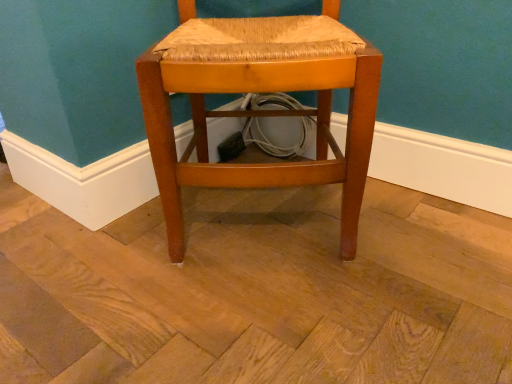
I want to click on free point below matte wood chair at center (from a real-world perspective), so click(x=268, y=213).